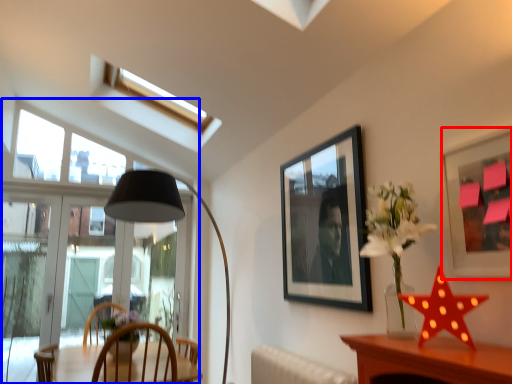
Question: Which of the following is the closest to the observer, picture frame (highlighted by a red box) or window (highlighted by a blue box)?

Choices:
 (A) picture frame
 (B) window

Answer: (A)